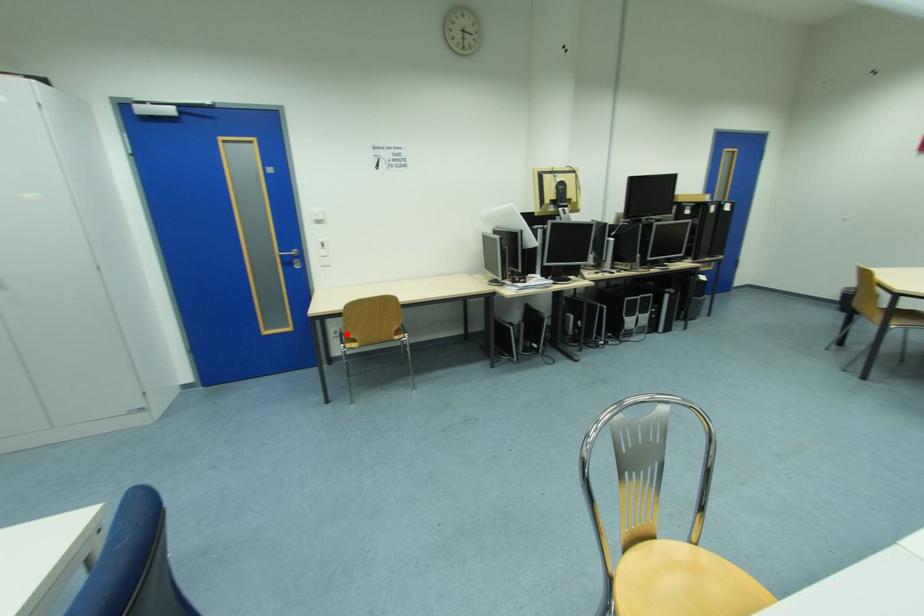
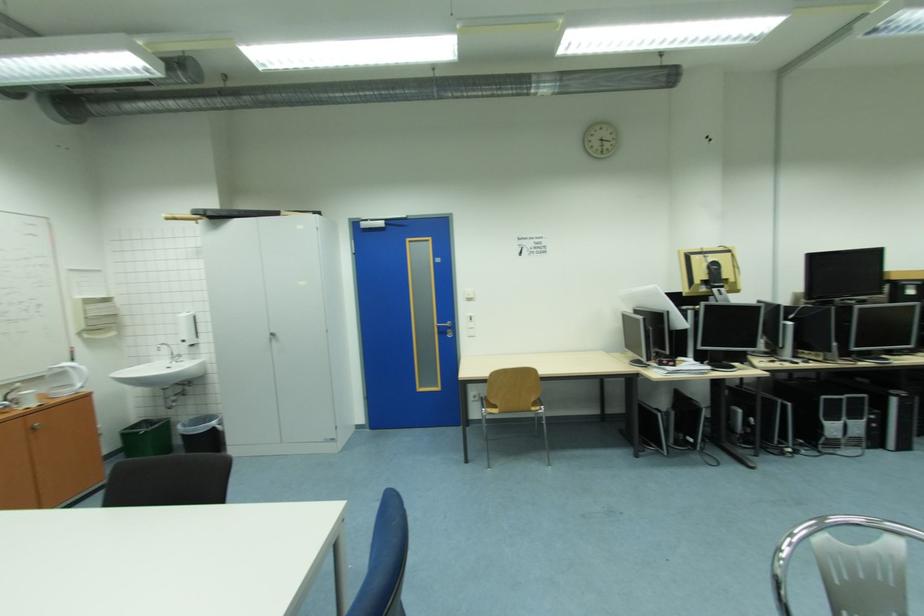
Locate, in the second image, the point that corresponds to the highlighted location in the first image.

(483, 400)